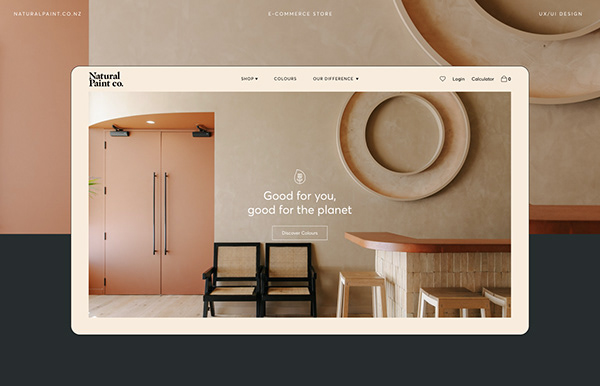
You are a GUI agent. You are given a task and a screenshot of the screen. Output one action in this format:
    pyautogui.click(x=<x>, y=<y>)
    Task: Click on the hinges
    This screenshot has width=600, height=386.
    Given the screenshot: What is the action you would take?
    pyautogui.click(x=104, y=141), pyautogui.click(x=104, y=186), pyautogui.click(x=106, y=236), pyautogui.click(x=108, y=273)